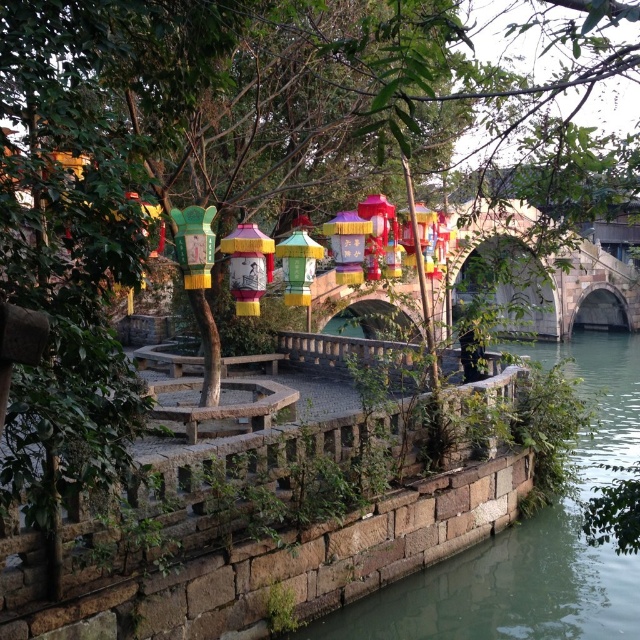
This screenshot has width=640, height=640. Describe the element at coordinates (531, 540) in the screenshot. I see `brown stone river at center` at that location.

Can you confirm if brown stone river at center is shorter than yellow-green paper lantern at center?

Incorrect, brown stone river at center's height does not fall short of yellow-green paper lantern at center's.

The image size is (640, 640). I want to click on brown stone river at center, so click(x=531, y=540).

At what (x,y) coordinates should I click in order to perform the action: click on brown stone river at center. Please return your answer as a coordinate pair (x, y). The image size is (640, 640). Looking at the image, I should click on (531, 540).

Does yellow paper lantern at center come behind multicolored paper lantern at center?

No.

What do you see at coordinates (248, 266) in the screenshot? The image size is (640, 640). I see `yellow paper lantern at center` at bounding box center [248, 266].

Who is more distant from viewer, (x=244, y=301) or (x=344, y=252)?

Positioned behind is point (x=344, y=252).

I want to click on yellow paper lantern at center, so point(248,266).

Between stone arch bridge at center and yellow-green paper lantern at center, which one has less height?

Standing shorter between the two is yellow-green paper lantern at center.

Is stone arch bridge at center below yellow-green paper lantern at center?

Indeed, stone arch bridge at center is positioned under yellow-green paper lantern at center.

Who is more forward, [556,259] or [294,225]?

Point [294,225]

Where is `stone arch bridge at center`? This screenshot has height=640, width=640. stone arch bridge at center is located at coordinates (577, 296).